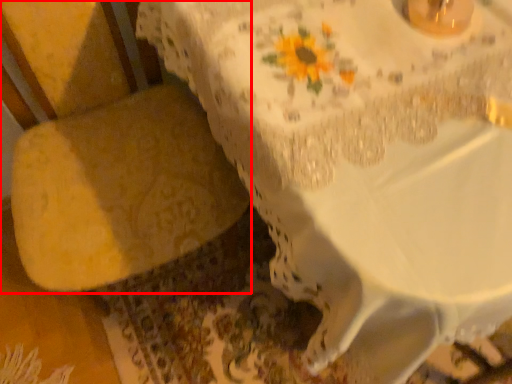
Question: Considering the relative positions of armchair (annotated by the red box) and table in the image provided, where is armchair (annotated by the red box) located with respect to the staircase?

Choices:
 (A) right
 (B) left

Answer: (B)